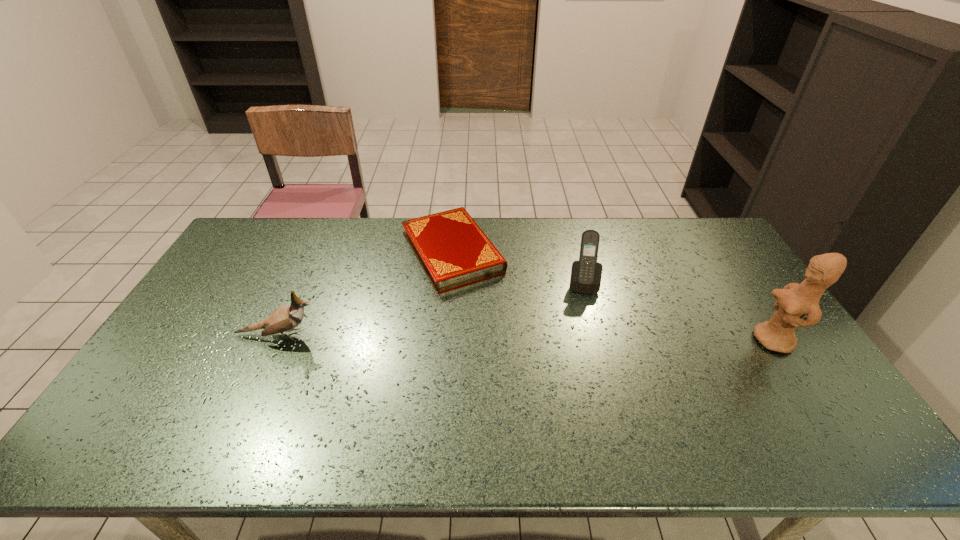
In the image, there is a desktop. Where is `free space at the far left corner`? free space at the far left corner is located at coordinates (246, 248).

Locate an element on the screen. The width and height of the screenshot is (960, 540). blank space at the near left corner of the desktop is located at coordinates (145, 415).

Find the location of a particular element. The image size is (960, 540). vacant space at the far right corner of the desktop is located at coordinates (692, 242).

This screenshot has width=960, height=540. Identify the location of empty space that is in between the shortest object and the tallest object. (612, 296).

This screenshot has height=540, width=960. Find the location of `free spot between the bird and the shortest object`. free spot between the bird and the shortest object is located at coordinates (365, 293).

Identify the location of free space between the leftmost object and the tallest object. (526, 338).

I want to click on free space between the second object from left to right and the third object from left to right, so click(517, 268).

Find the location of `vacant space that is in between the bird and the shortest object`. vacant space that is in between the bird and the shortest object is located at coordinates (365, 293).

Locate an element on the screen. The width and height of the screenshot is (960, 540). free space between the figurine and the hardback book is located at coordinates (612, 296).

At what (x,y) coordinates should I click in order to perform the action: click on free area in between the tallest object and the shortest object. Please return your answer as a coordinate pair (x, y). Looking at the image, I should click on (612, 296).